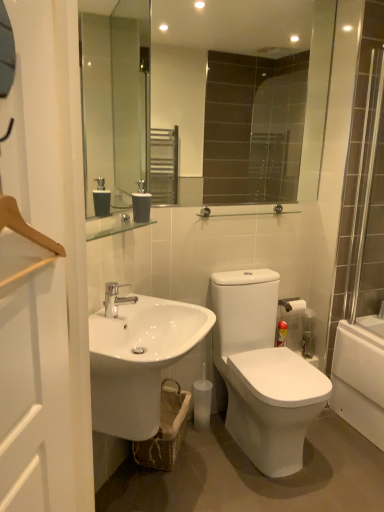
I want to click on white matte toilet paper at right, so click(292, 305).

Measure the distance between point (x=284, y=303) and camera.

Point (x=284, y=303) is 8.01 feet from camera.

In order to face white glossy sink at lower left, should I rotate leftwards or rightwards?

Turn left by 5.527 degrees to look at white glossy sink at lower left.

Locate an element on the screen. The image size is (384, 512). white matte toilet paper at right is located at coordinates (292, 305).

Consider the image. Is silver metallic faucet at center wider than silver metallic shower door at right?

Correct, the width of silver metallic faucet at center exceeds that of silver metallic shower door at right.

Between silver metallic faucet at center and silver metallic shower door at right, which one appears on the left side from the viewer's perspective?

Positioned to the left is silver metallic faucet at center.

Would you say silver metallic faucet at center is a long distance from silver metallic shower door at right?

Yes, silver metallic faucet at center and silver metallic shower door at right are located far from each other.

Is point (61, 483) more distant than point (200, 325)?

No, it is in front of (200, 325).

Visually, is white wooden screen door at left positioned to the left or to the right of white glossy sink at lower left?

white wooden screen door at left is positioned on white glossy sink at lower left's left side.

Between white wooden screen door at left and white glossy sink at lower left, which one has less height?

white glossy sink at lower left is shorter.

From a real-world perspective, between white wooden screen door at left and white glossy sink at lower left, who is vertically lower?

white glossy sink at lower left.

Is there a large distance between white matte toilet paper at right and matte gray soap dispenser at center?

Yes.

What's the angular difference between white matte toilet paper at right and matte gray soap dispenser at center's facing directions?

The angular difference between white matte toilet paper at right and matte gray soap dispenser at center is 46.9 degrees.

Measure the distance between white matte toilet paper at right and matte gray soap dispenser at center.

white matte toilet paper at right is 3.32 feet away from matte gray soap dispenser at center.

Is white matte toilet paper at right taller than matte gray soap dispenser at center?

In fact, white matte toilet paper at right may be shorter than matte gray soap dispenser at center.

Can you see white wooden screen door at left touching clear glass rail at upper center?

There is a gap between white wooden screen door at left and clear glass rail at upper center.

Between white wooden screen door at left and clear glass rail at upper center, which one has less height?

Standing shorter between the two is clear glass rail at upper center.

From a real-world perspective, is white wooden screen door at left under clear glass rail at upper center?

Correct, in the physical world, white wooden screen door at left is lower than clear glass rail at upper center.

Looking at this image, can you tell me how much white wooden screen door at left and clear glass rail at upper center differ in facing direction?

There is a 59.3-degree angle between the facing directions of white wooden screen door at left and clear glass rail at upper center.

Is metallic silver can at right behind white glossy sink at lower left?

Yes, it is behind white glossy sink at lower left.

Can you confirm if metallic silver can at right is positioned to the right of white glossy sink at lower left?

Indeed, metallic silver can at right is positioned on the right side of white glossy sink at lower left.

Could you tell me if metallic silver can at right is facing white glossy sink at lower left?

No, metallic silver can at right is not aimed at white glossy sink at lower left.

Who is smaller, white matte toilet paper at right or metallic silver can at right?

metallic silver can at right.

From a real-world perspective, is white matte toilet paper at right below metallic silver can at right?

No, from a real-world perspective, white matte toilet paper at right is not beneath metallic silver can at right.

From the picture: From the image's perspective, is white matte toilet paper at right over metallic silver can at right?

Yes, from the image's perspective, white matte toilet paper at right is over metallic silver can at right.

In terms of width, does white matte toilet paper at right look wider or thinner when compared to metallic silver can at right?

Considering their sizes, white matte toilet paper at right looks broader than metallic silver can at right.

Between white glossy sink at lower left and clear glass rail at upper center, which one appears on the left side from the viewer's perspective?

From the viewer's perspective, white glossy sink at lower left appears more on the left side.

Between white glossy sink at lower left and clear glass rail at upper center, which one has larger width?

With larger width is white glossy sink at lower left.

Who is bigger, white glossy sink at lower left or clear glass rail at upper center?

A: white glossy sink at lower left is bigger.

Considering the positions of objects white glossy sink at lower left and clear glass rail at upper center in the image provided, who is behind, white glossy sink at lower left or clear glass rail at upper center?

clear glass rail at upper center is behind.

Locate an element on the screen. tap in front of the silver metallic shower door at right is located at coordinates (115, 298).

In the image, there is a white wooden screen door at left. Identify the location of sink below it (from a real-world perspective). (138, 360).

Looking at the image, which one is located closer to clear glass rail at upper center, matte gray soap dispenser at center or glossy glass mirror at upper center?

matte gray soap dispenser at center lies closer to clear glass rail at upper center than the other object.

From the picture: Which object lies further to the anchor point silver metallic shower door at right, metallic silver can at right or glossy glass mirror at upper center?

Among the two, glossy glass mirror at upper center is located further to silver metallic shower door at right.

Looking at the image, which one is located closer to silver metallic shower door at right, white wooden screen door at left or white glossy sink at lower left?

white glossy sink at lower left.

When comparing their distances from matte gray soap dispenser at center, does clear glass rail at upper center or white matte toilet paper at right seem closer?

clear glass rail at upper center is closer to matte gray soap dispenser at center.

Based on their spatial positions, is matte gray soap dispenser at center or silver metallic faucet at center closer to clear glass rail at upper center?

matte gray soap dispenser at center is closer to clear glass rail at upper center.

When comparing their distances from matte gray soap dispenser at center, does white glossy sink at lower left or silver metallic faucet at center seem further?

white glossy sink at lower left is positioned further to the anchor matte gray soap dispenser at center.

From the image, which object appears to be nearer to metallic silver can at right, clear glass rail at upper center or white matte toilet paper at right?

Among the two, white matte toilet paper at right is located nearer to metallic silver can at right.

Which object lies nearer to the anchor point glossy glass mirror at upper center, silver metallic faucet at center or white matte toilet paper at right?

white matte toilet paper at right is closer to glossy glass mirror at upper center.

Locate an element on the screen. The width and height of the screenshot is (384, 512). shower door between glossy glass mirror at upper center and metallic silver can at right from top to bottom is located at coordinates (368, 191).

Image resolution: width=384 pixels, height=512 pixels. I want to click on balustrade located between silver metallic faucet at center and metallic silver can at right in the left-right direction, so click(246, 212).

You are a GUI agent. You are given a task and a screenshot of the screen. Output one action in this format:
    pyautogui.click(x=<x>, y=<y>)
    Task: Click on the balustrade between white glossy sink at lower left and white matte toilet paper at right along the z-axis
    
    Given the screenshot: What is the action you would take?
    pyautogui.click(x=246, y=212)

Find the location of `mirror between white wooden screen door at left and white matte toilet paper at right from front to back`. mirror between white wooden screen door at left and white matte toilet paper at right from front to back is located at coordinates (216, 103).